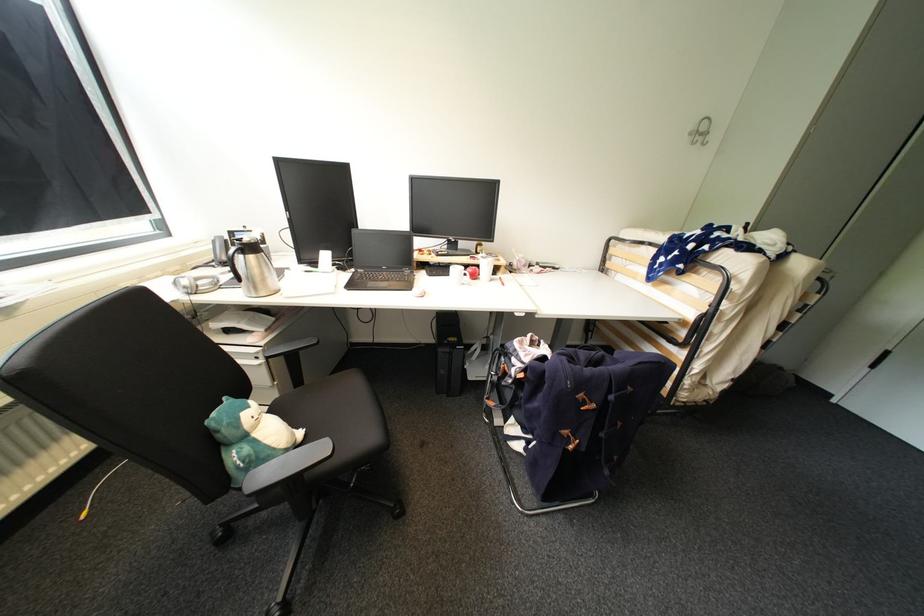
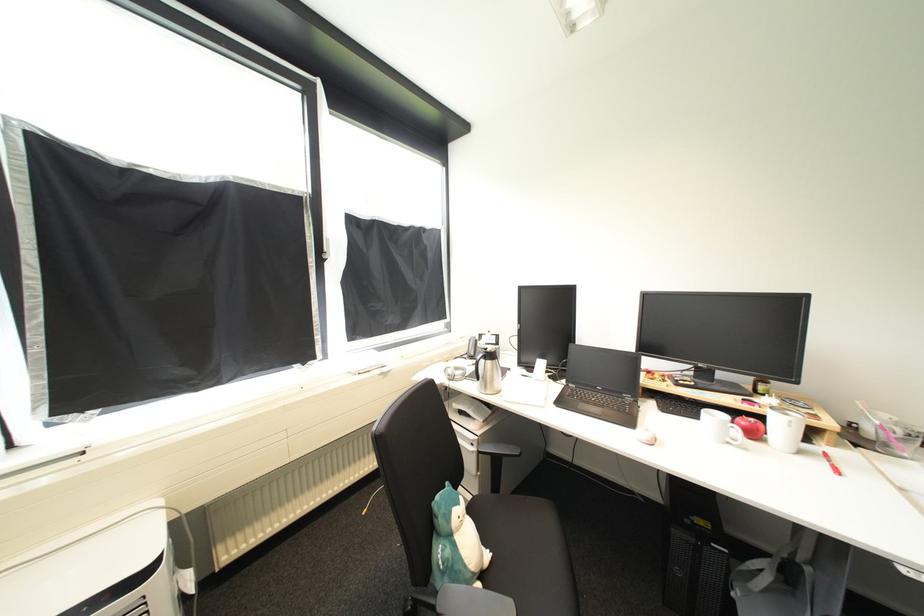
The point at (x=473, y=363) is marked in the first image. Where is the corresponding point in the second image?

(745, 591)